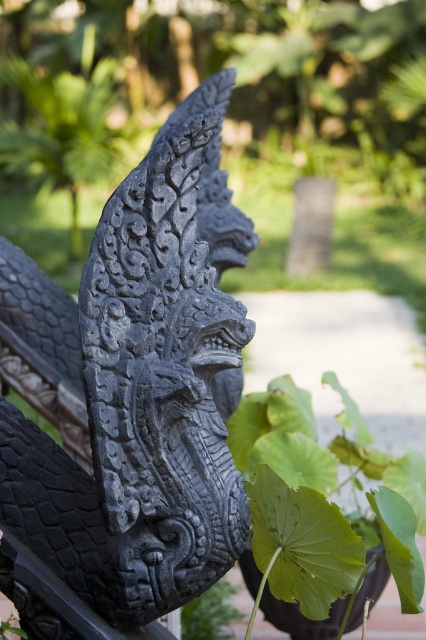
Question: Based on their relative distances, which object is farther from the green leafy plant at lower center?

Choices:
 (A) green leafy plant at lower right
 (B) black stone dragon head at center

Answer: (B)

Question: Does black stone dragon head at center have a larger size compared to green leafy plant at lower right?

Choices:
 (A) no
 (B) yes

Answer: (A)

Question: Which point is farther to the camera?

Choices:
 (A) (14, 502)
 (B) (222, 579)

Answer: (B)

Question: Is black stone dragon head at center below green leafy plant at lower center?

Choices:
 (A) no
 (B) yes

Answer: (A)

Question: Which point appears farthest from the camera in this image?

Choices:
 (A) (219, 189)
 (B) (270, 419)

Answer: (A)

Question: Can you confirm if black stone dragon head at center is positioned to the left of green leafy plant at lower right?

Choices:
 (A) yes
 (B) no

Answer: (A)